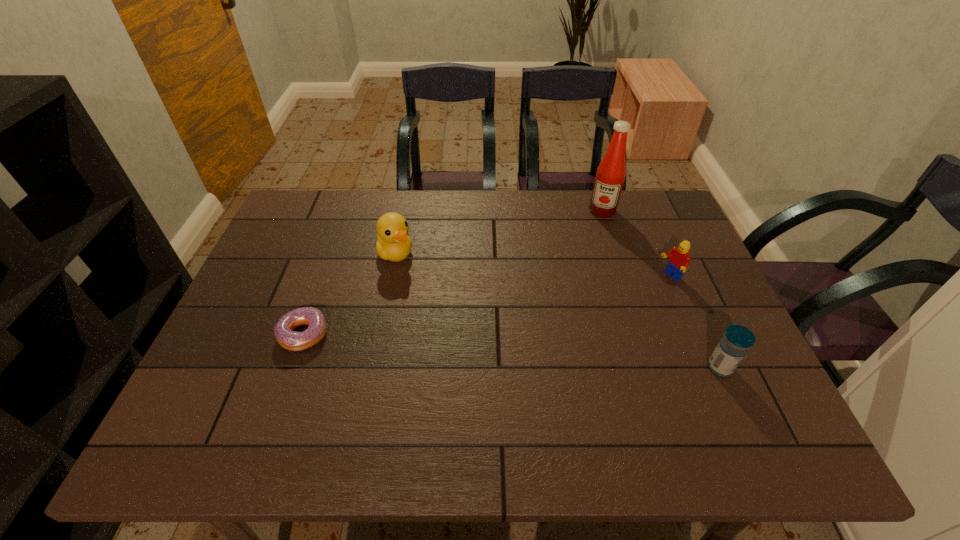
At what (x,y) coordinates should I click in order to perform the action: click on free spot between the third object from right to left and the shortest object. Please return your answer as a coordinate pair (x, y). Looking at the image, I should click on (x=453, y=272).

Locate an element on the screen. Image resolution: width=960 pixels, height=540 pixels. vacant area between the Lego and the second tallest object is located at coordinates (533, 265).

You are a GUI agent. You are given a task and a screenshot of the screen. Output one action in this format:
    pyautogui.click(x=<x>, y=<y>)
    Task: Click on the empty location between the shortest object and the Lego
    
    Given the screenshot: What is the action you would take?
    [x=488, y=305]

You are a GUI agent. You are given a task and a screenshot of the screen. Output one action in this format:
    pyautogui.click(x=<x>, y=<y>)
    Task: Click on the free spot between the duck and the fourth farthest object
    
    Given the screenshot: What is the action you would take?
    pyautogui.click(x=349, y=294)

Identify the location of vacant region between the Lego and the medicine. The image size is (960, 540). (695, 322).

Identify the location of unoccupied area between the medicine and the Lego. (695, 322).

Where is `unoccupied area between the duck and the farthest object`? unoccupied area between the duck and the farthest object is located at coordinates (499, 232).

This screenshot has height=540, width=960. Find the location of `unoccupied position between the second object from left to right and the leftmost object`. unoccupied position between the second object from left to right and the leftmost object is located at coordinates (349, 294).

What are the coordinates of `empty space between the nearest object and the condiment` in the screenshot? It's located at (661, 289).

Where is `unoccupied area between the shortest object and the medicine`? unoccupied area between the shortest object and the medicine is located at coordinates (512, 350).